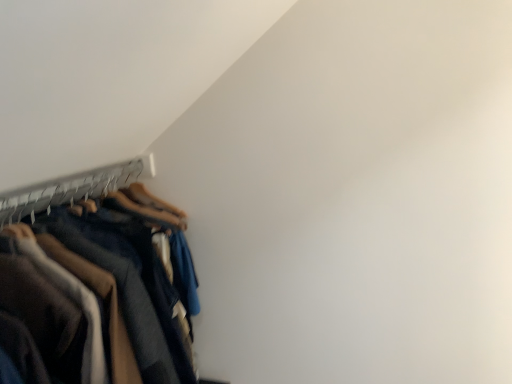
Question: Would you say dark blue cotton trousers at left is inside or outside wooden hanger at left?

Choices:
 (A) inside
 (B) outside

Answer: (B)

Question: From a real-world perspective, is dark blue cotton trousers at left positioned above or below wooden hanger at left?

Choices:
 (A) above
 (B) below

Answer: (B)

Question: Is point (6, 291) positioned closer to the camera than point (115, 170)?

Choices:
 (A) closer
 (B) farther

Answer: (A)

Question: Is wooden hanger at left taller or shorter than dark blue cotton trousers at left?

Choices:
 (A) tall
 (B) short

Answer: (B)

Question: In terms of size, does wooden hanger at left appear bigger or smaller than dark blue cotton trousers at left?

Choices:
 (A) big
 (B) small

Answer: (B)

Question: Considering the positions of wooden hanger at left and dark blue cotton trousers at left in the image, is wooden hanger at left wider or thinner than dark blue cotton trousers at left?

Choices:
 (A) thin
 (B) wide

Answer: (A)

Question: From the image's perspective, relative to dark blue cotton trousers at left, is wooden hanger at left above or below?

Choices:
 (A) above
 (B) below

Answer: (A)